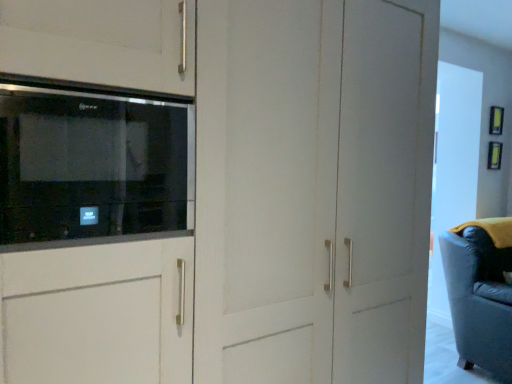
Question: From a real-world perspective, is black glass microwave at upper left under leather swivel chair at right?

Choices:
 (A) no
 (B) yes

Answer: (A)

Question: Is black glass microwave at upper left at the left side of leather swivel chair at right?

Choices:
 (A) yes
 (B) no

Answer: (A)

Question: From the image's perspective, is black glass microwave at upper left above leather swivel chair at right?

Choices:
 (A) yes
 (B) no

Answer: (A)

Question: Considering the relative sizes of black glass microwave at upper left and leather swivel chair at right in the image provided, is black glass microwave at upper left wider than leather swivel chair at right?

Choices:
 (A) no
 (B) yes

Answer: (A)

Question: Can you confirm if black glass microwave at upper left is thinner than leather swivel chair at right?

Choices:
 (A) yes
 (B) no

Answer: (A)

Question: Is leather swivel chair at right at the back of black glass microwave at upper left?

Choices:
 (A) no
 (B) yes

Answer: (A)

Question: From a real-world perspective, does leather swivel chair at right stand above black glass microwave at upper left?

Choices:
 (A) yes
 (B) no

Answer: (B)

Question: Is leather swivel chair at right closer to the viewer compared to black glass microwave at upper left?

Choices:
 (A) no
 (B) yes

Answer: (A)

Question: From the image's perspective, is leather swivel chair at right above black glass microwave at upper left?

Choices:
 (A) no
 (B) yes

Answer: (A)

Question: Could black glass microwave at upper left be considered to be inside leather swivel chair at right?

Choices:
 (A) no
 (B) yes

Answer: (A)

Question: Is leather swivel chair at right wider than black glass microwave at upper left?

Choices:
 (A) no
 (B) yes

Answer: (B)

Question: Does leather swivel chair at right have a greater height compared to black glass microwave at upper left?

Choices:
 (A) yes
 (B) no

Answer: (A)

Question: Considering the positions of point (90, 208) and point (478, 306), is point (90, 208) closer or farther from the camera than point (478, 306)?

Choices:
 (A) closer
 (B) farther

Answer: (A)